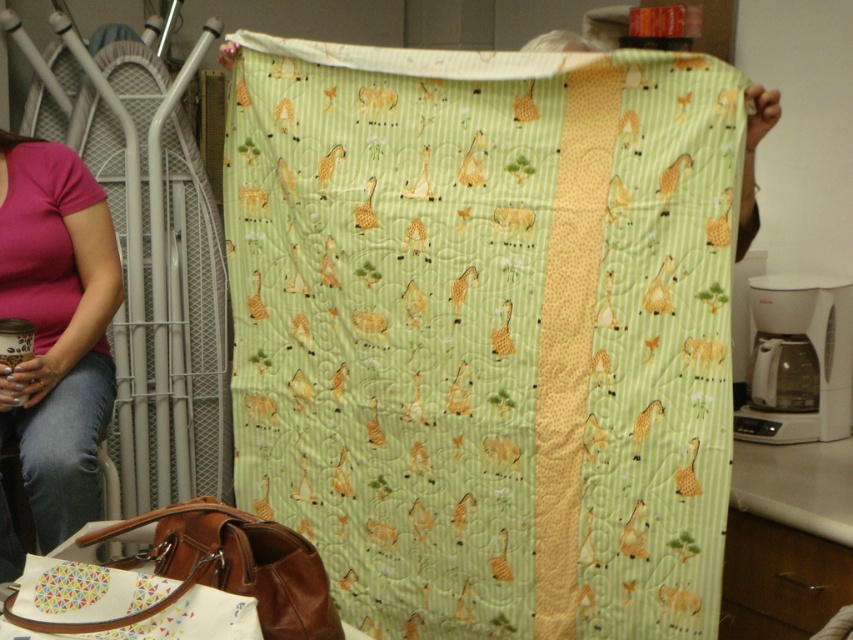
Is point (7, 232) less distant than point (292, 540)?

No.

Who is taller, pink fabric shirt at left or brown leather bag at lower left?

pink fabric shirt at left

Where is `pink fabric shirt at left`? The image size is (853, 640). pink fabric shirt at left is located at coordinates click(x=56, y=326).

Based on the photo, who is positioned more to the right, green quilted fabric at center or brown leather bag at lower left?

green quilted fabric at center is more to the right.

Which is in front, point (256, 257) or point (181, 545)?

Point (181, 545) is in front.

Where is `green quilted fabric at center`? The width and height of the screenshot is (853, 640). green quilted fabric at center is located at coordinates (486, 330).

Does green quilted fabric at center have a larger size compared to pink fabric shirt at left?

Indeed, green quilted fabric at center has a larger size compared to pink fabric shirt at left.

Does green quilted fabric at center come behind pink fabric shirt at left?

That is False.

Does point (686, 257) come in front of point (62, 209)?

That is True.

Find the location of a particular element. The width and height of the screenshot is (853, 640). green quilted fabric at center is located at coordinates (486, 330).